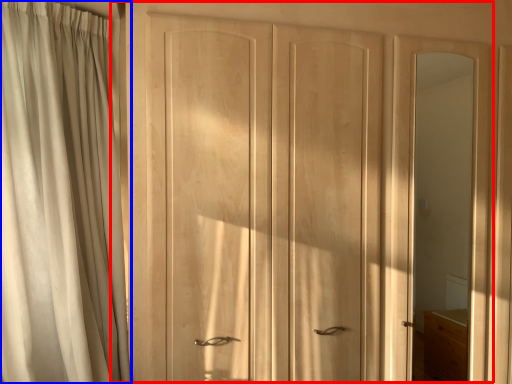
Question: Which of the following is the closest to the observer, door (highlighted by a red box) or curtain (highlighted by a blue box)?

Choices:
 (A) door
 (B) curtain

Answer: (B)